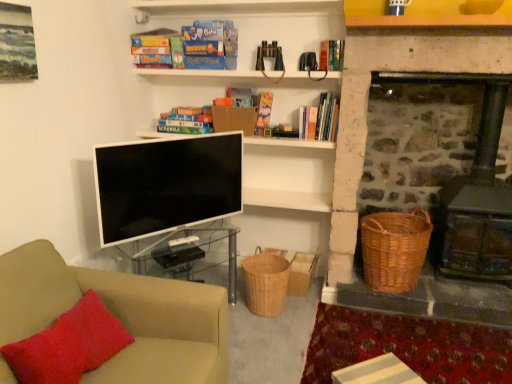
Question: Is matte cardboard book at upper center, arranged as the 5th book when viewed from the right, placed right next to beige fabric couch at lower left?

Choices:
 (A) yes
 (B) no

Answer: (B)

Question: Does matte cardboard book at upper center, arranged as the 5th book when viewed from the right, have a greater height compared to beige fabric couch at lower left?

Choices:
 (A) no
 (B) yes

Answer: (A)

Question: Is matte cardboard book at upper center, which ranks as the 1th book in left-to-right order, to the right of beige fabric couch at lower left from the viewer's perspective?

Choices:
 (A) no
 (B) yes

Answer: (A)

Question: Can you confirm if matte cardboard book at upper center, arranged as the 5th book when viewed from the right, is shorter than beige fabric couch at lower left?

Choices:
 (A) no
 (B) yes

Answer: (B)

Question: Is matte cardboard book at upper center, which ranks as the 1th book in left-to-right order, far away from beige fabric couch at lower left?

Choices:
 (A) yes
 (B) no

Answer: (A)

Question: From a real-world perspective, is white striped paper at lower right above or below woven brown basket at lower center, the third basket from the right?

Choices:
 (A) below
 (B) above

Answer: (A)

Question: Would you say white striped paper at lower right is inside or outside woven brown basket at lower center, the third basket from the right?

Choices:
 (A) inside
 (B) outside

Answer: (B)

Question: In terms of size, does white striped paper at lower right appear bigger or smaller than woven brown basket at lower center, which appears as the first basket when viewed from the left?

Choices:
 (A) big
 (B) small

Answer: (A)

Question: Considering the positions of white striped paper at lower right and woven brown basket at lower center, the third basket from the right, in the image, is white striped paper at lower right wider or thinner than woven brown basket at lower center, the third basket from the right,?

Choices:
 (A) thin
 (B) wide

Answer: (B)

Question: Is woven brown basket at lower center, which appears as the first basket when viewed from the left, in front of or behind woven brown basket at lower center, which is the second basket from left to right, in the image?

Choices:
 (A) behind
 (B) front

Answer: (B)

Question: Is woven brown basket at lower center, the third basket from the right, spatially inside woven brown basket at lower center, positioned as the second basket in right-to-left order, or outside of it?

Choices:
 (A) inside
 (B) outside

Answer: (B)

Question: From the image's perspective, relative to woven brown basket at lower center, which is the second basket from left to right, is woven brown basket at lower center, the third basket from the right, above or below?

Choices:
 (A) below
 (B) above

Answer: (A)

Question: Considering the positions of point (256, 268) and point (290, 289), is point (256, 268) closer or farther from the camera than point (290, 289)?

Choices:
 (A) farther
 (B) closer

Answer: (B)

Question: In the image, is white striped wood table at lower center on the left side or the right side of blue cardboard game at upper center, which is the 3th book from right to left?

Choices:
 (A) left
 (B) right

Answer: (B)

Question: Is white striped wood table at lower center wider or thinner than blue cardboard game at upper center, which is the 3th book from right to left?

Choices:
 (A) wide
 (B) thin

Answer: (B)